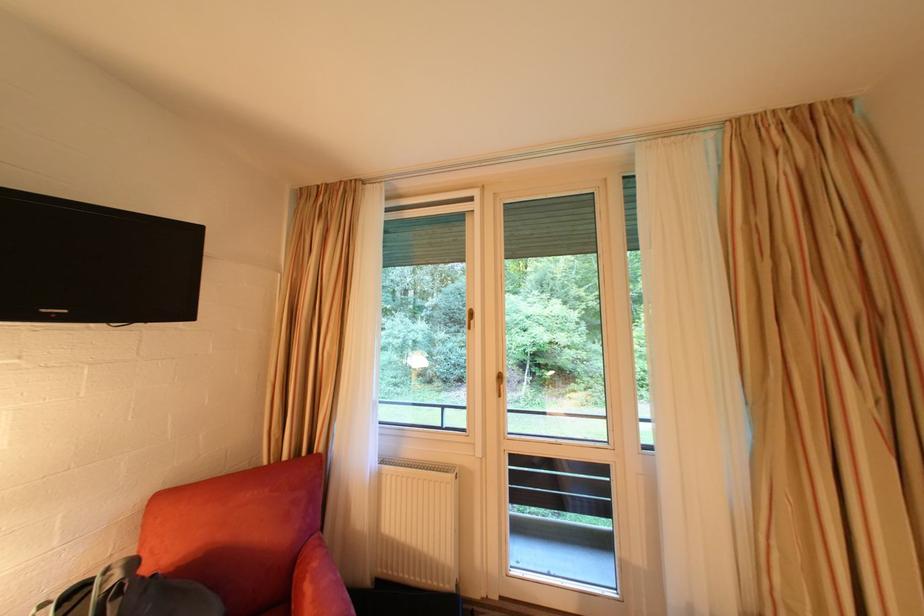
The height and width of the screenshot is (616, 924). What do you see at coordinates (318, 583) in the screenshot?
I see `the red chair armrest` at bounding box center [318, 583].